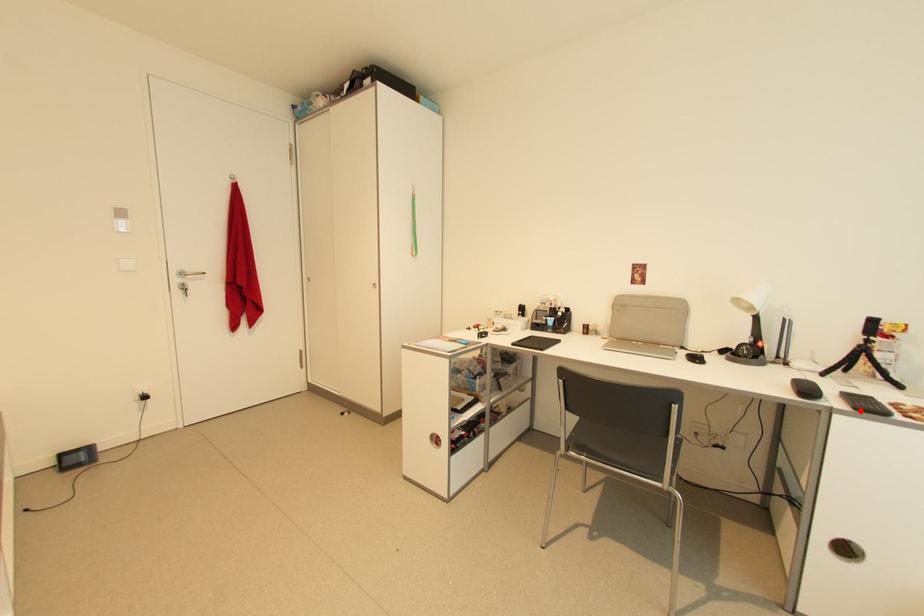
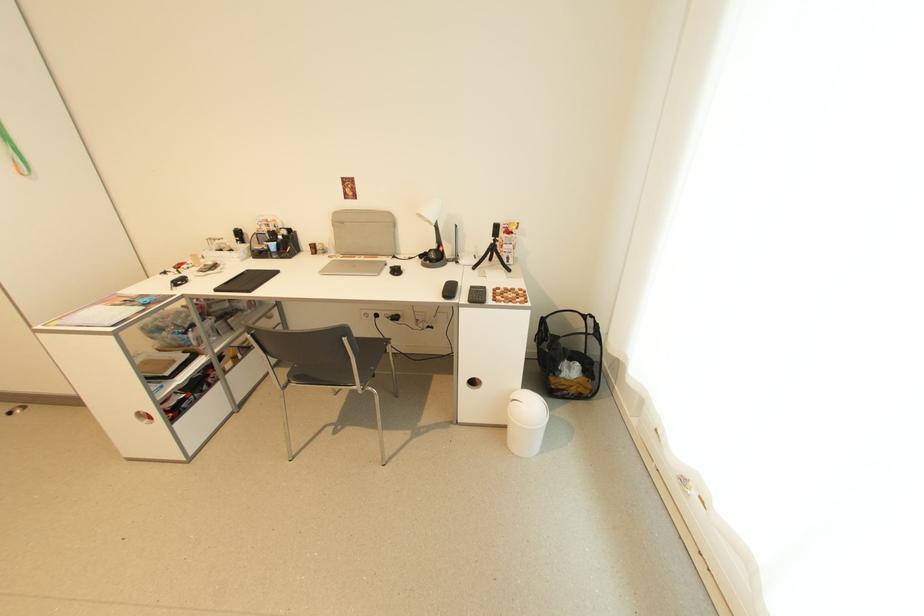
Where in the second image is the point corresponding to the highlighted location from the first image?

(473, 302)